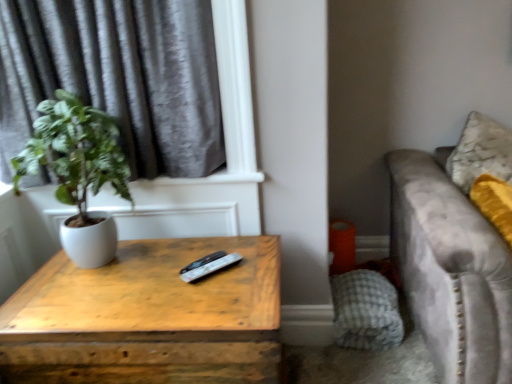
Locate an element on the screen. free space above gray checkered pillow at lower right (from a real-world perspective) is located at coordinates (355, 291).